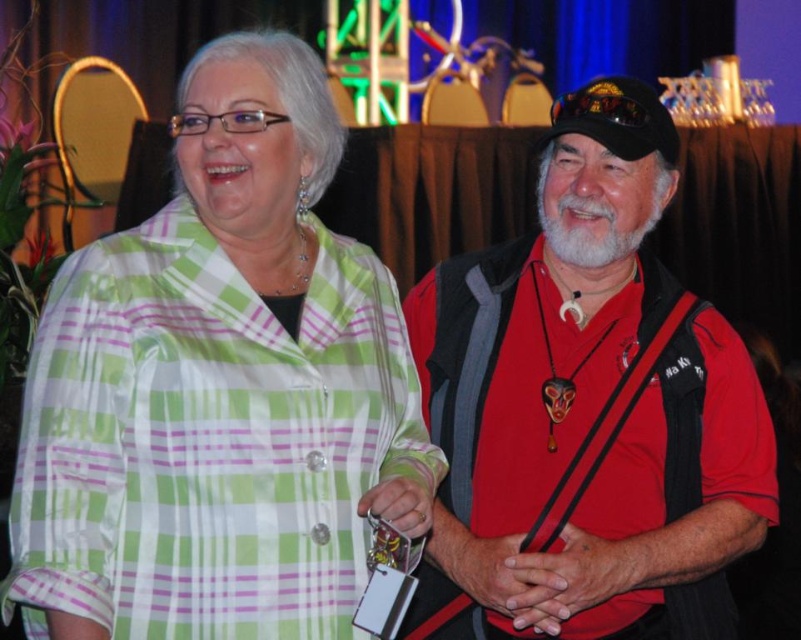
Does green plaid shirt at upper left have a greater height compared to red matte vest at right?

Indeed, green plaid shirt at upper left has a greater height compared to red matte vest at right.

Is point (160, 552) less distant than point (727, 356)?

Yes.

What do you see at coordinates (219, 388) in the screenshot? I see `green plaid shirt at upper left` at bounding box center [219, 388].

The width and height of the screenshot is (801, 640). What are the coordinates of `green plaid shirt at upper left` in the screenshot? It's located at (219, 388).